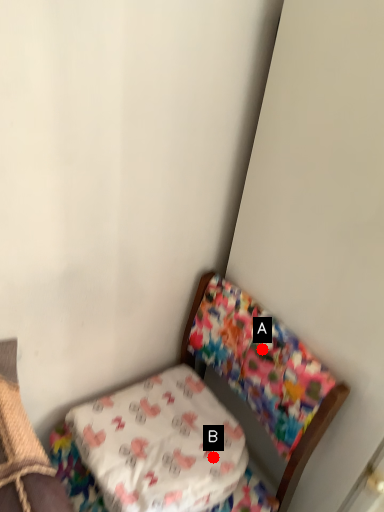
Question: Two points are circled on the image, labeled by A and B beside each circle. Which point appears farthest from the camera in this image?

Choices:
 (A) A is further
 (B) B is further

Answer: (B)